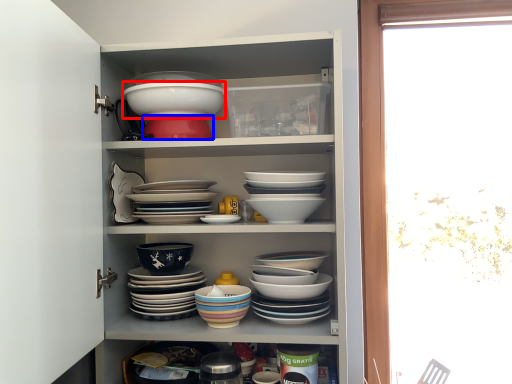
Question: Which object appears farthest to the camera in this image, bowl (highlighted by a red box) or bowl (highlighted by a blue box)?

Choices:
 (A) bowl
 (B) bowl

Answer: (B)